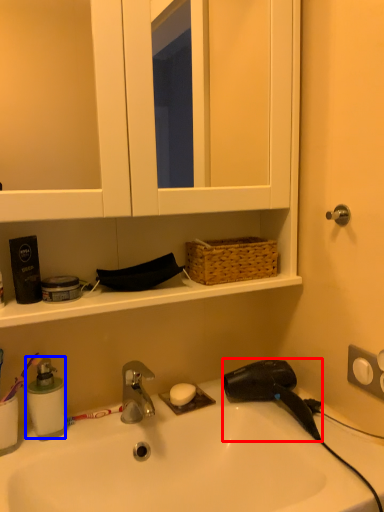
Question: Which of the following is the farthest to the observer, hair drier (highlighted by a red box) or soap dispenser (highlighted by a blue box)?

Choices:
 (A) hair drier
 (B) soap dispenser

Answer: (B)